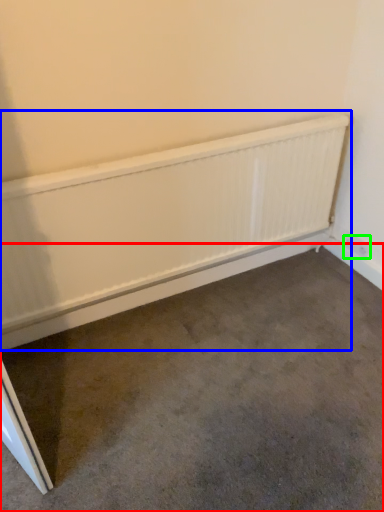
Question: Estimate the real-world distances between objects in this image. Which object is farther from concrete (highlighted by a red box), radiator (highlighted by a blue box) or electric outlet (highlighted by a green box)?

Choices:
 (A) radiator
 (B) electric outlet

Answer: (B)